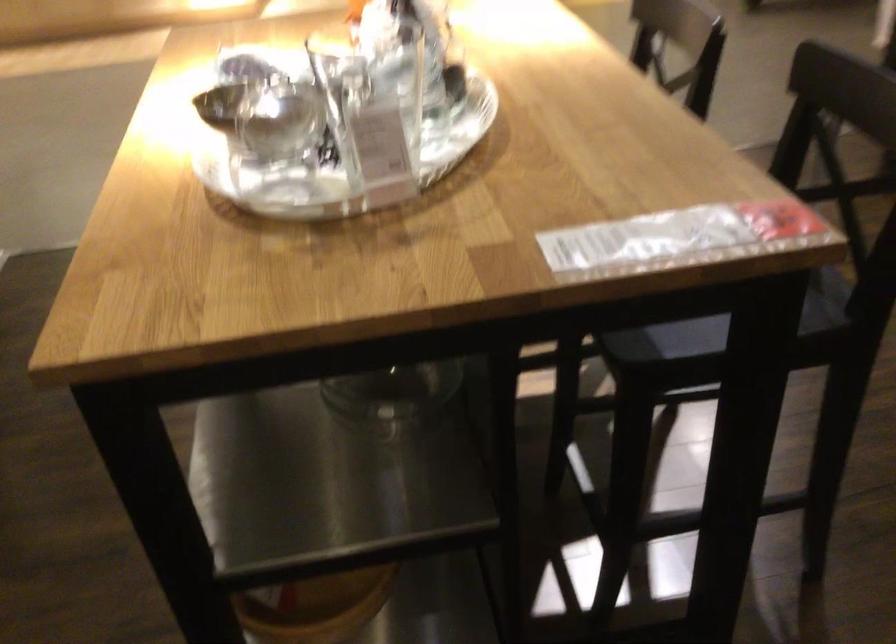
Find where to lift the plastic wrapped item. Please return your answer as a coordinate pair (x, y).

(676, 238)